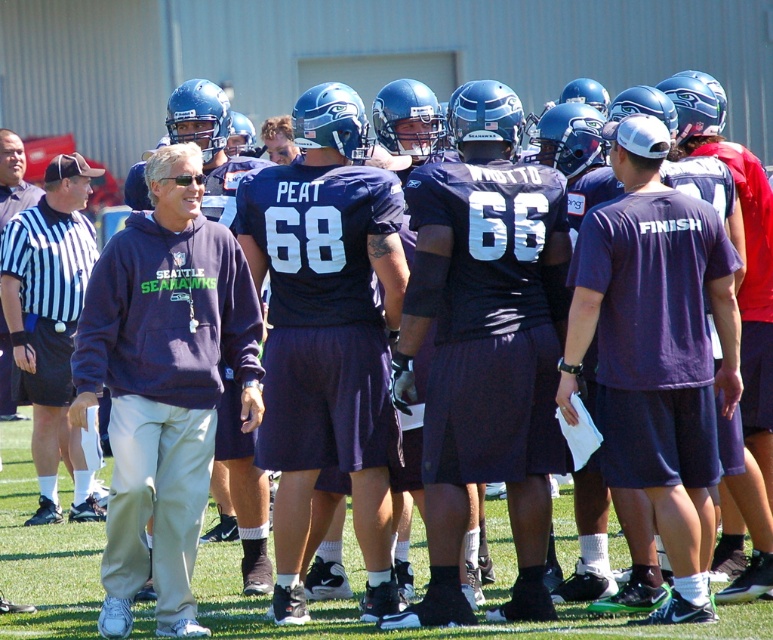
Measure the distance between navy fleece sweatshirt at center and camera.

They are 11.75 meters apart.

Is navy fleece sweatshirt at center positioned at the back of dark blue sweatshirt at left?

No, it is not.

Between point (179, 492) and point (19, 273), which one is positioned behind?

Positioned behind is point (19, 273).

The width and height of the screenshot is (773, 640). Find the location of `navy fleece sweatshirt at center`. navy fleece sweatshirt at center is located at coordinates (164, 381).